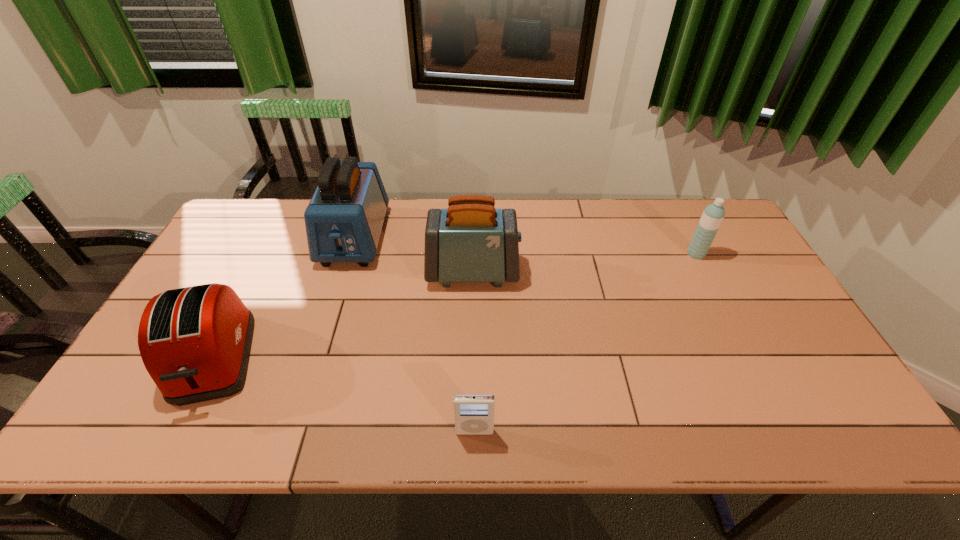
You are a GUI agent. You are given a task and a screenshot of the screen. Output one action in this format:
    pyautogui.click(x=<x>, y=<y>)
    Task: Click on the vacant area in the image that satisfies the following two spatial constraints: 1. on the front-facing side of the water bottle; 2. on the right side of the second toaster from right to left
    This screenshot has height=540, width=960.
    Given the screenshot: What is the action you would take?
    pyautogui.click(x=349, y=254)